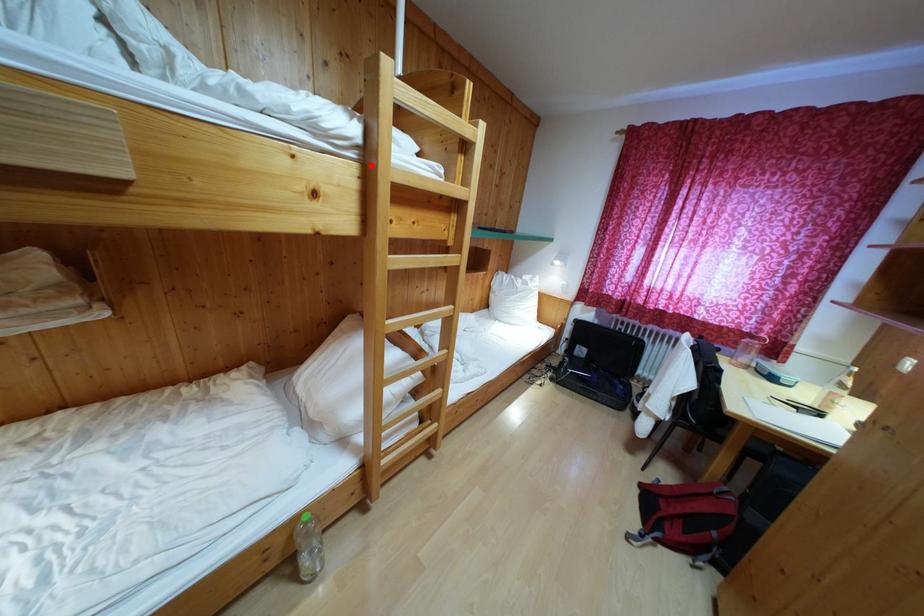
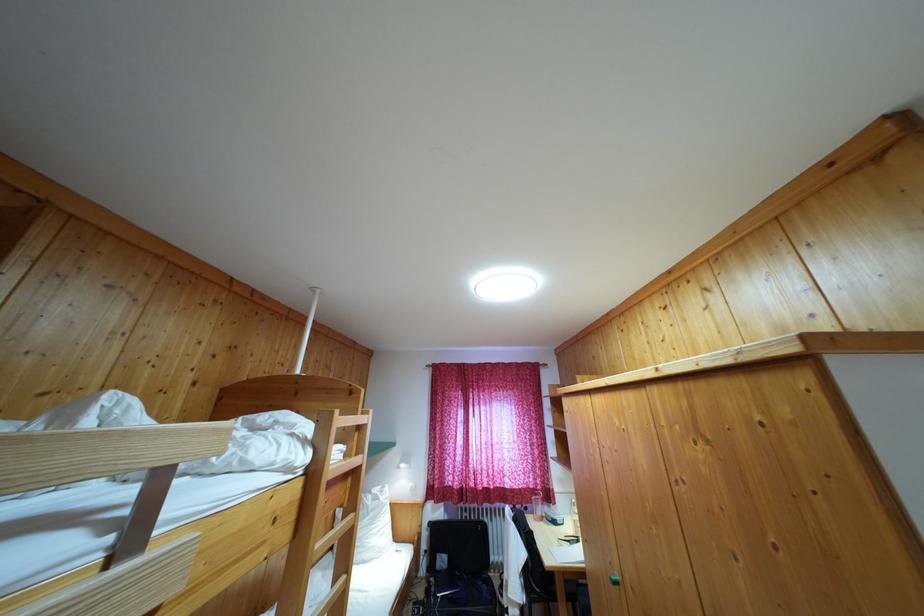
Find the pixel in the second image that matches the highlighted location in the first image.

(317, 479)